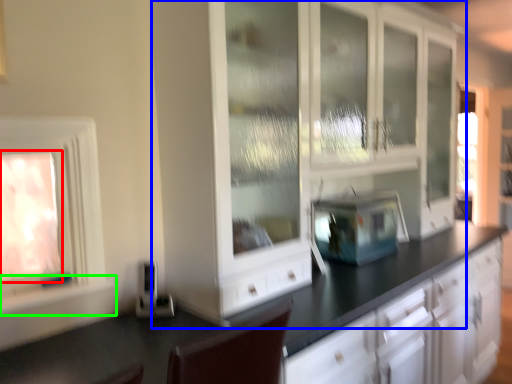
Question: Which is nearer to the window (highlighted by a red box)? cabinetry (highlighted by a blue box) or window sill (highlighted by a green box).

Choices:
 (A) cabinetry
 (B) window sill

Answer: (B)